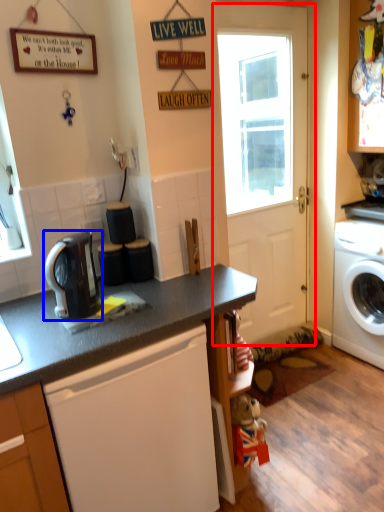
Question: Which point is further to the camera, door (highlighted by a red box) or kitchen appliance (highlighted by a blue box)?

Choices:
 (A) door
 (B) kitchen appliance

Answer: (A)